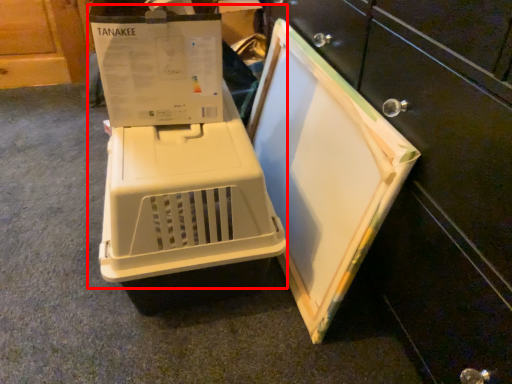
Question: From the image's perspective, considering the relative positions of appliance (annotated by the red box) and home appliance in the image provided, where is appliance (annotated by the red box) located with respect to the staircase?

Choices:
 (A) above
 (B) below

Answer: (B)